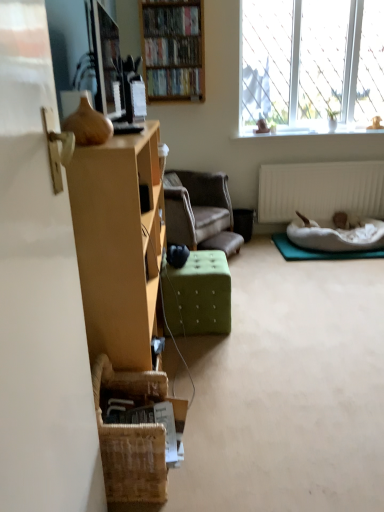
What are the coordinates of `empty space that is ontop of hardcover books at upper center, the first book ordered from the bottom (from a real-world perspective)` in the screenshot? It's located at (183, 66).